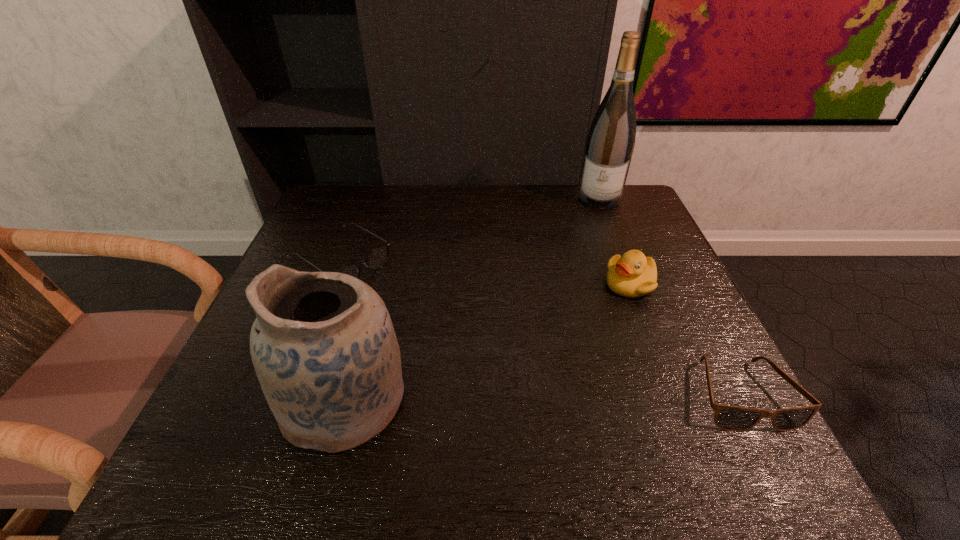
I want to click on free point between the second tallest object and the sunglasses, so click(542, 397).

Identify the location of free space between the spectacles and the third tallest object. The image size is (960, 540). (486, 272).

At what (x,y) coordinates should I click in order to perform the action: click on object that stands as the fourth closest to the fourth shortest object. Please return your answer as a coordinate pair (x, y). The height and width of the screenshot is (540, 960). Looking at the image, I should click on (610, 143).

Locate an element on the screen. object that is the nearest to the spectacles is located at coordinates [x=323, y=346].

At what (x,y) coordinates should I click in order to perform the action: click on vacant position in the image that satisfies the following two spatial constraints: 1. on the back side of the tallest object; 2. on the right side of the pottery. Please return your answer as a coordinate pair (x, y). Image resolution: width=960 pixels, height=540 pixels. Looking at the image, I should click on (398, 198).

What are the coordinates of `free space that satisfies the following two spatial constraints: 1. on the back side of the third shortest object; 2. on the left side of the farthest object` in the screenshot? It's located at (597, 198).